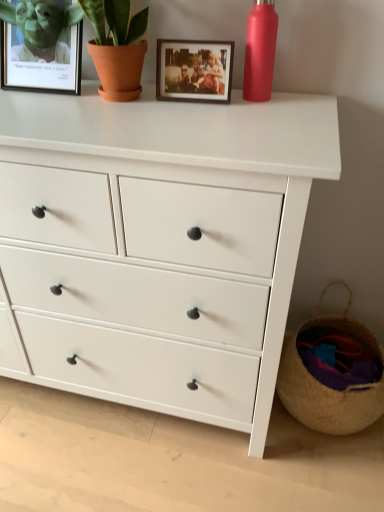
Question: Would you say woven straw basket at lower right is outside wooden photo frame at upper center, the 1th picture frame from the right?

Choices:
 (A) no
 (B) yes

Answer: (B)

Question: From a real-world perspective, does woven straw basket at lower right sit lower than wooden photo frame at upper center, the 1th picture frame from the right?

Choices:
 (A) yes
 (B) no

Answer: (A)

Question: Can you confirm if woven straw basket at lower right is taller than wooden photo frame at upper center, which is counted as the 2th picture frame, starting from the left?

Choices:
 (A) no
 (B) yes

Answer: (B)

Question: Considering the relative sizes of woven straw basket at lower right and wooden photo frame at upper center, the 1th picture frame from the right, in the image provided, is woven straw basket at lower right shorter than wooden photo frame at upper center, the 1th picture frame from the right,?

Choices:
 (A) no
 (B) yes

Answer: (A)

Question: Could you tell me if woven straw basket at lower right is turned towards wooden photo frame at upper center, which is counted as the 2th picture frame, starting from the left?

Choices:
 (A) no
 (B) yes

Answer: (A)

Question: Considering the positions of wooden photo frame at upper center, the 1th picture frame from the right, and matte red bottle at upper right in the image, is wooden photo frame at upper center, the 1th picture frame from the right, wider or thinner than matte red bottle at upper right?

Choices:
 (A) wide
 (B) thin

Answer: (A)

Question: Is wooden photo frame at upper center, which is counted as the 2th picture frame, starting from the left, in front of or behind matte red bottle at upper right in the image?

Choices:
 (A) front
 (B) behind

Answer: (B)

Question: From the image's perspective, is wooden photo frame at upper center, the 1th picture frame from the right, positioned above or below matte red bottle at upper right?

Choices:
 (A) above
 (B) below

Answer: (B)

Question: From a real-world perspective, is wooden photo frame at upper center, the 1th picture frame from the right, physically located above or below matte red bottle at upper right?

Choices:
 (A) above
 (B) below

Answer: (B)

Question: Considering the positions of point (264, 302) and point (259, 52), is point (264, 302) closer or farther from the camera than point (259, 52)?

Choices:
 (A) closer
 (B) farther

Answer: (A)

Question: Is white matte chest of drawers at center in front of or behind matte red bottle at upper right in the image?

Choices:
 (A) behind
 (B) front

Answer: (B)

Question: Would you say white matte chest of drawers at center is inside or outside matte red bottle at upper right?

Choices:
 (A) inside
 (B) outside

Answer: (B)

Question: From the image's perspective, relative to matte red bottle at upper right, is white matte chest of drawers at center above or below?

Choices:
 (A) below
 (B) above

Answer: (A)

Question: Visually, is woven straw basket at lower right positioned to the left or to the right of matte black picture frame at upper left, marked as the 1th picture frame in a left-to-right arrangement?

Choices:
 (A) right
 (B) left

Answer: (A)

Question: Is woven straw basket at lower right in front of or behind matte black picture frame at upper left, marked as the 1th picture frame in a left-to-right arrangement, in the image?

Choices:
 (A) front
 (B) behind

Answer: (B)